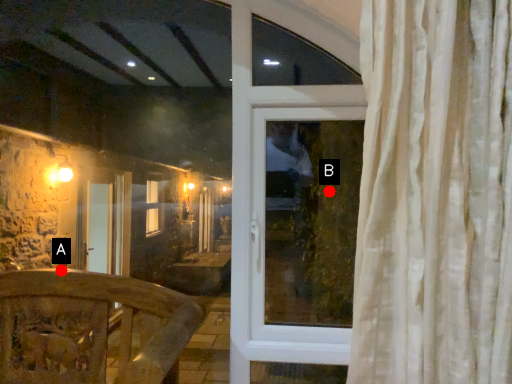
Question: Two points are circled on the image, labeled by A and B beside each circle. Among these points, which one is nearest to the camera?

Choices:
 (A) A is closer
 (B) B is closer

Answer: (B)